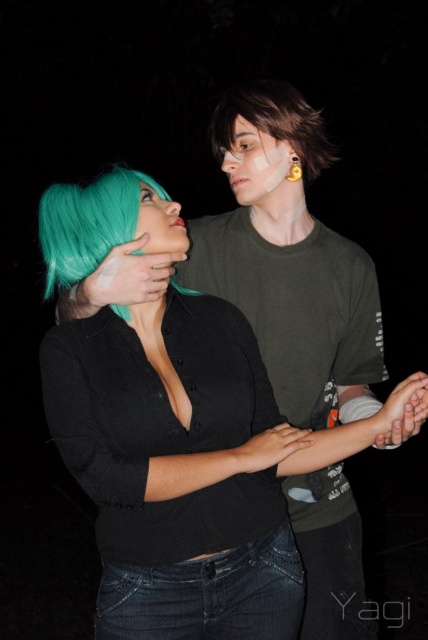
You are a photographer trying to capture a closeup of the matte black shirt at center. Your camera has a minimum focusing distance of 4 feet. Can you take the photo without moving the camera or the shirt?

The matte black shirt at center and camera are 3.86 feet apart from each other, which is less than the 4 feet minimum focusing distance. Therefore, you cannot take the photo without moving the camera or the shirt closer.

You are an artist analyzing the composition of this image. Based on the positions of the matte black face at upper center and the teal matte wig at center, which object is positioned higher in the frame?

The matte black face at upper center is positioned higher in the frame than the teal matte wig at center.